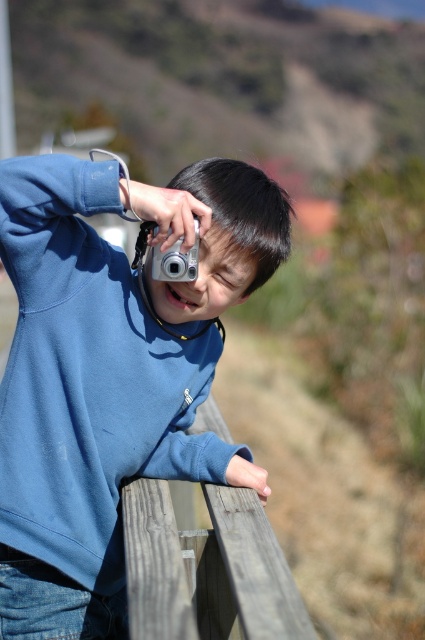
You are standing at the point marked as point (201, 532) and want to take a photo of the wooden railing. Since the camera requires a minimum distance of 1.5 meters to focus properly, will you be able to take a clear photo?

The distance of point (201, 532) from viewer is 1.89 meters, which is greater than the camera minimum focusing distance of 1.5 meters, so yes, you can take a clear photo.

Consider the image. You are a photographer trying to capture the perfect shot. You notice the blue matte sweatshirt at center and the silver metallic camera at upper center in your frame. Which object appears larger in the image?

The blue matte sweatshirt at center appears larger than the silver metallic camera at upper center because it is taller according to the description.

You are trying to take a photo of the weathered wood fence at lower center using the silver metallic camera at upper center. Which direction should you move the camera to frame the fence properly?

The weathered wood fence at lower center is to the right of the silver metallic camera at upper center, so you should move the camera to the right to frame the fence properly.